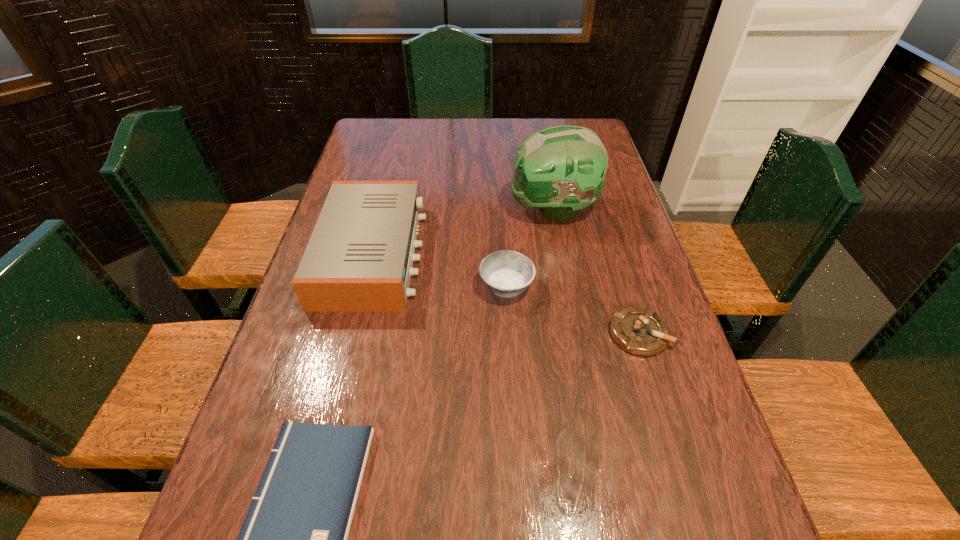
This screenshot has width=960, height=540. I want to click on vacant area that lies between the taller ashtray and the radio receiver, so click(x=440, y=270).

Image resolution: width=960 pixels, height=540 pixels. Identify the location of free spot between the tallest object and the left ashtray. (529, 248).

Where is `free area in between the fourth shortest object and the football helmet`? free area in between the fourth shortest object and the football helmet is located at coordinates (463, 232).

Locate an element on the screen. This screenshot has height=540, width=960. free space between the tallest object and the second tallest object is located at coordinates [x=463, y=232].

Where is `object that is the second closest one to the shortest object`? object that is the second closest one to the shortest object is located at coordinates (505, 273).

Select which object is the closest to the paperback book. Please provide its 2D coordinates. Your answer should be formatted as a tuple, i.e. [(x, y)], where the tuple contains the x and y coordinates of a point satisfying the conditions above.

[(360, 255)]

Identify the location of free location that satisfies the following two spatial constraints: 1. on the visor of the nearer ashtray; 2. on the left side of the football helmet. (576, 333).

Identify the location of vacant space that satisfies the following two spatial constraints: 1. on the visor of the tallest object; 2. on the back side of the nearer ashtray. (576, 333).

Find the location of a particular element. The width and height of the screenshot is (960, 540). free location that satisfies the following two spatial constraints: 1. on the front side of the third tallest object; 2. on the left side of the shorter ashtray is located at coordinates (509, 333).

Identify the location of free space that satisfies the following two spatial constraints: 1. on the visor of the tallest object; 2. on the right side of the shorter ashtray. The width and height of the screenshot is (960, 540). (576, 333).